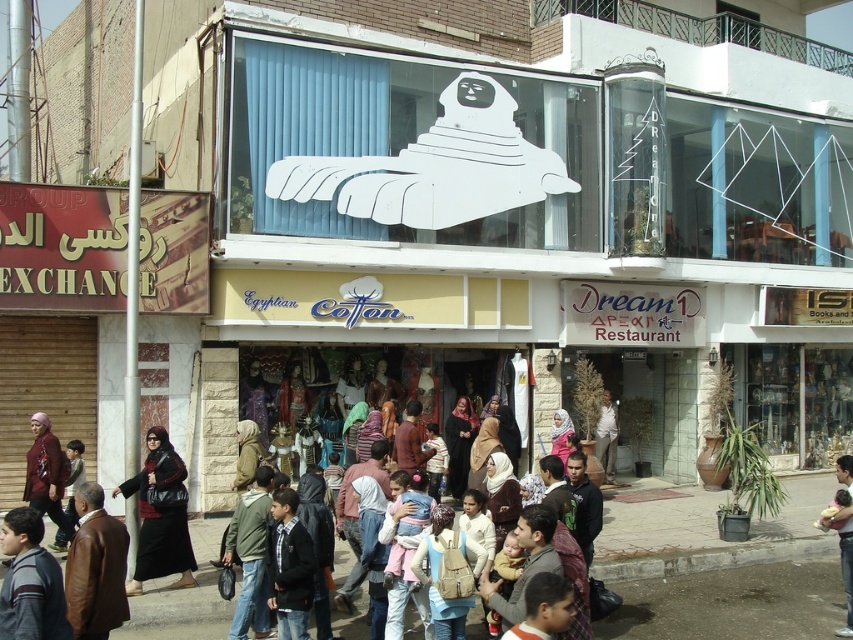
Question: Considering the real-world distances, which object is closest to the striped sweater at lower left?

Choices:
 (A) maroon fabric hijab at center
 (B) brown leather jacket at lower left
 (C) dark brown leather jacket at center
 (D) black leather abaya at center

Answer: (B)

Question: Which object is positioned farthest from the maroon fabric hijab at center?

Choices:
 (A) brown leather jacket at lower left
 (B) dark brown leather jacket at center
 (C) black leather abaya at center

Answer: (B)

Question: Is brown leather jacket at lower left above maroon fabric hijab at center?

Choices:
 (A) no
 (B) yes

Answer: (B)

Question: Does black leather abaya at center have a larger size compared to dark brown leather jacket at center?

Choices:
 (A) no
 (B) yes

Answer: (B)

Question: Which point is farther from the camera taking this photo?

Choices:
 (A) (7, 513)
 (B) (32, 449)
 (C) (848, 492)
 (D) (85, 625)

Answer: (B)

Question: Observing the image, what is the correct spatial positioning of striped sweater at lower left in reference to maroon fabric hijab at center?

Choices:
 (A) above
 (B) below

Answer: (A)